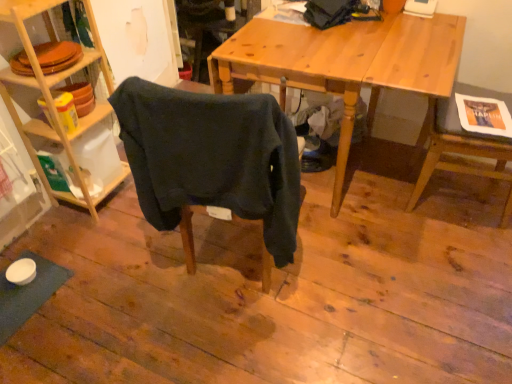
The height and width of the screenshot is (384, 512). I want to click on vacant space in front of wooden desk at center, so click(x=360, y=291).